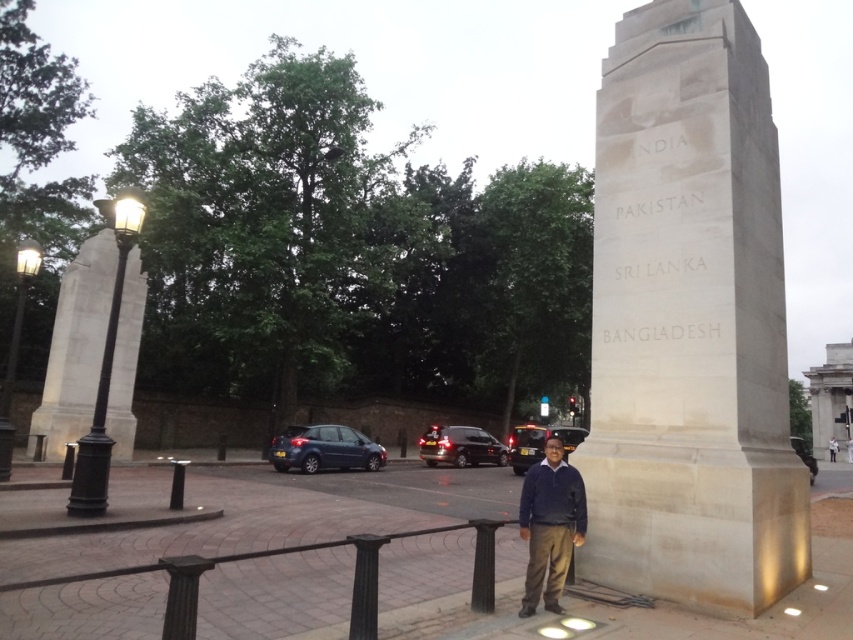
Question: Is white stone monument at right to the right of light brown leather jacket at center from the viewer's perspective?

Choices:
 (A) yes
 (B) no

Answer: (B)

Question: Is smooth stone column at left positioned before dark blue sweater at center?

Choices:
 (A) yes
 (B) no

Answer: (B)

Question: Does smooth stone column at left appear on the right side of light brown leather jacket at center?

Choices:
 (A) no
 (B) yes

Answer: (A)

Question: Which of the following is the farthest from the observer?

Choices:
 (A) dark blue sweater at center
 (B) smooth stone column at left

Answer: (B)

Question: Which object is farther from the camera taking this photo?

Choices:
 (A) white stone monument at right
 (B) light brown leather jacket at center
 (C) dark blue sweater at center

Answer: (B)

Question: Which object is closer to the camera taking this photo?

Choices:
 (A) smooth stone column at left
 (B) light brown leather jacket at center
 (C) dark blue sweater at center

Answer: (C)